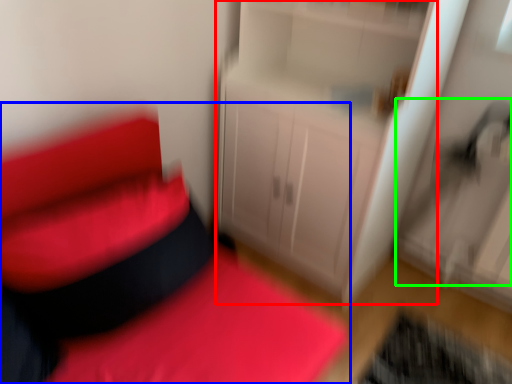
Question: Considering the real-world distances, which object is closest to dresser (highlighted by a red box)? furniture (highlighted by a blue box) or swivel chair (highlighted by a green box).

Choices:
 (A) furniture
 (B) swivel chair

Answer: (B)